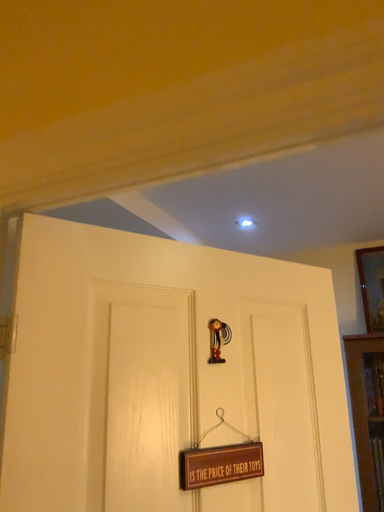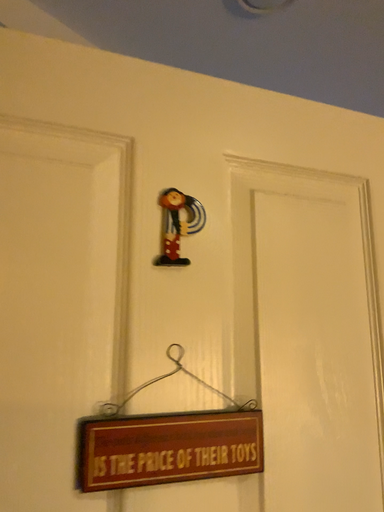
Question: How did the camera likely rotate when shooting the video?

Choices:
 (A) rotated right
 (B) rotated left

Answer: (B)